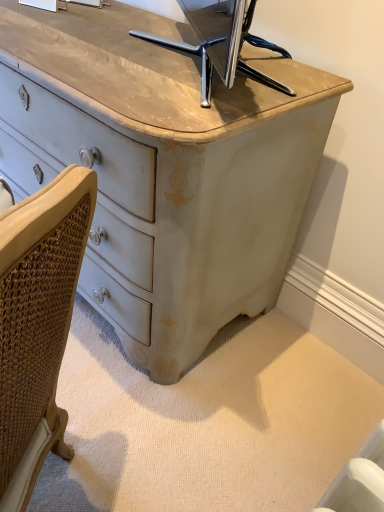
Identify the location of metallic silver tv stand at upper center. The image size is (384, 512). (222, 42).

The image size is (384, 512). Describe the element at coordinates (222, 42) in the screenshot. I see `metallic silver tv stand at upper center` at that location.

Find the location of a particular element. metallic silver tv stand at upper center is located at coordinates (222, 42).